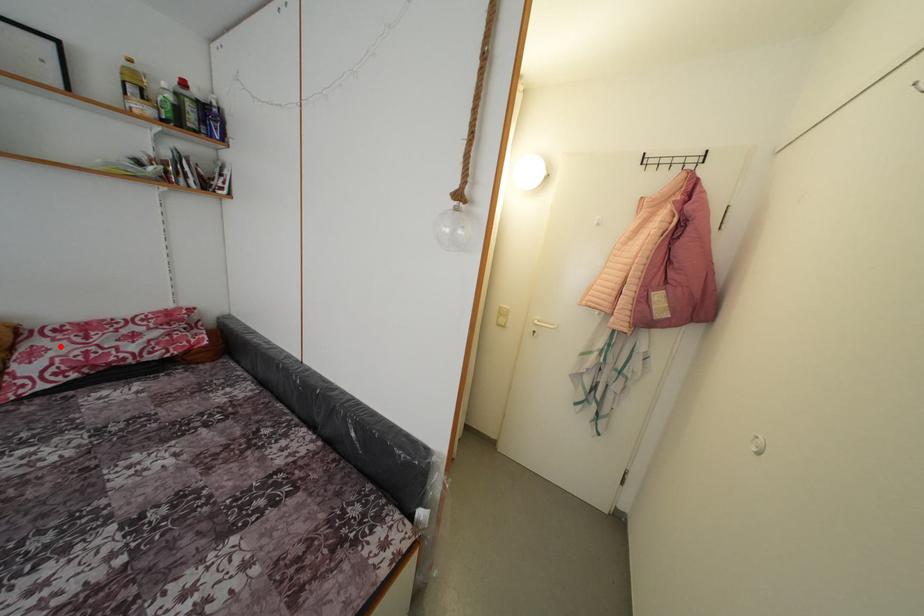
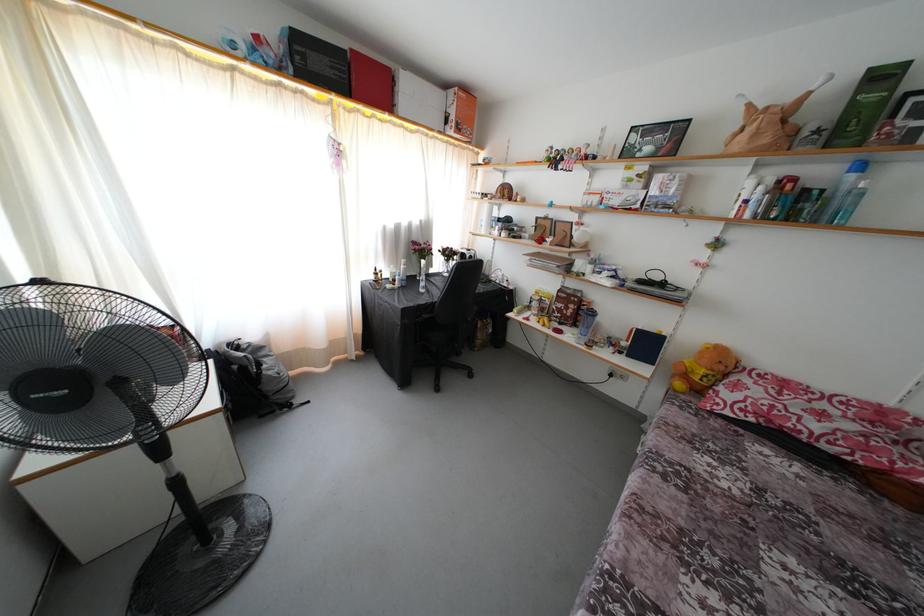
Find the pixel in the second image that matches the highlighted location in the first image.

(760, 389)